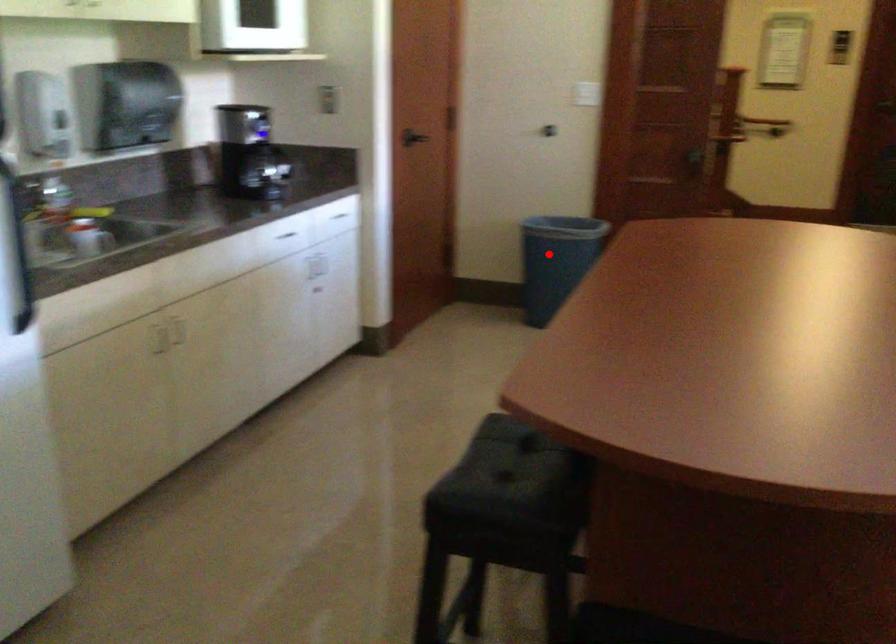
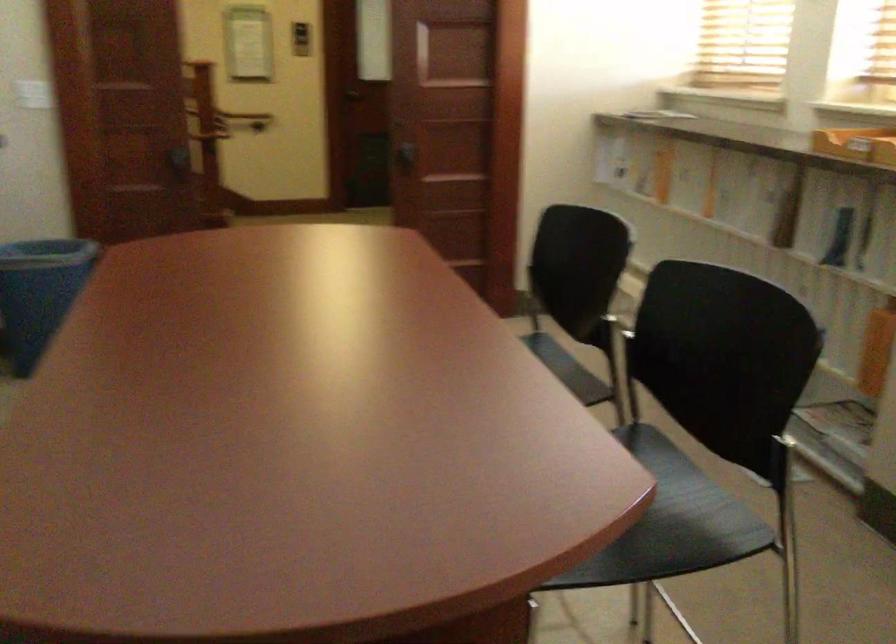
Question: I am providing you with two images of the same scene from different viewpoints. Image1 has a red point marked. In image2, the corresponding 3D location appears at what relative position? Reply with the corresponding letter.

Choices:
 (A) Closer
 (B) Farther

Answer: (A)